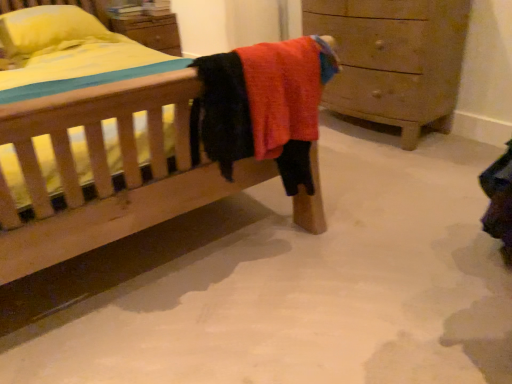
Question: Is wooden chest of drawers at right positioned beyond the bounds of yellow fabric pillow at upper left?

Choices:
 (A) no
 (B) yes

Answer: (B)

Question: Would you say wooden chest of drawers at right is a long distance from yellow fabric pillow at upper left?

Choices:
 (A) yes
 (B) no

Answer: (A)

Question: Is wooden chest of drawers at right at the left side of yellow fabric pillow at upper left?

Choices:
 (A) yes
 (B) no

Answer: (B)

Question: Can yellow fabric pillow at upper left be found inside wooden chest of drawers at right?

Choices:
 (A) no
 (B) yes

Answer: (A)

Question: From a real-world perspective, is wooden chest of drawers at right positioned over yellow fabric pillow at upper left based on gravity?

Choices:
 (A) yes
 (B) no

Answer: (B)

Question: Considering the relative sizes of wooden chest of drawers at right and yellow fabric pillow at upper left in the image provided, is wooden chest of drawers at right taller than yellow fabric pillow at upper left?

Choices:
 (A) no
 (B) yes

Answer: (B)

Question: Is yellow fabric pillow at upper left located outside wooden chest of drawers at right?

Choices:
 (A) no
 (B) yes

Answer: (B)

Question: From the image's perspective, is yellow fabric pillow at upper left located beneath wooden chest of drawers at right?

Choices:
 (A) no
 (B) yes

Answer: (A)

Question: Is yellow fabric pillow at upper left at the left side of wooden chest of drawers at right?

Choices:
 (A) yes
 (B) no

Answer: (A)

Question: Does yellow fabric pillow at upper left appear on the right side of wooden chest of drawers at right?

Choices:
 (A) no
 (B) yes

Answer: (A)

Question: Is yellow fabric pillow at upper left thinner than wooden chest of drawers at right?

Choices:
 (A) yes
 (B) no

Answer: (B)

Question: Does yellow fabric pillow at upper left have a greater width compared to wooden chest of drawers at right?

Choices:
 (A) yes
 (B) no

Answer: (A)

Question: Does point (398, 41) appear closer or farther from the camera than point (7, 21)?

Choices:
 (A) closer
 (B) farther

Answer: (A)